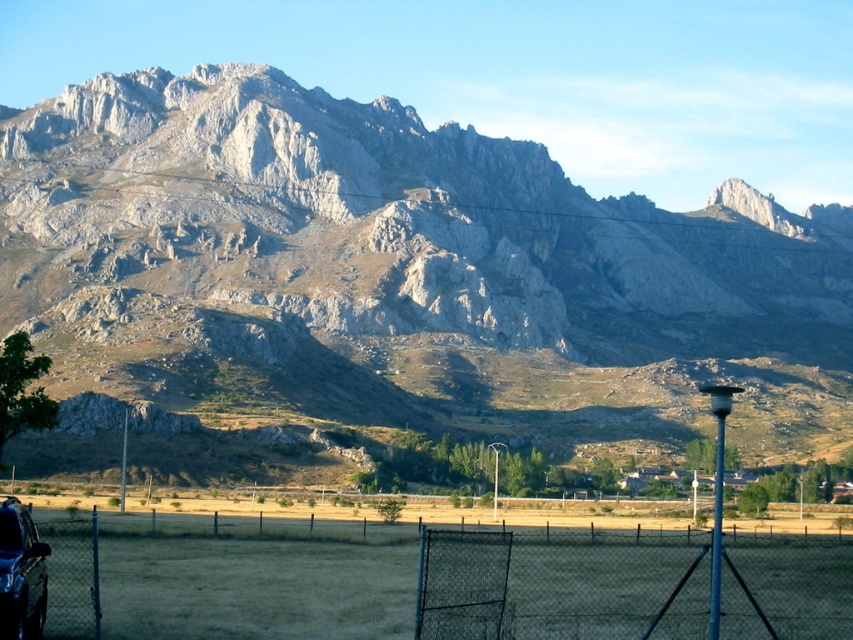
Question: Which of these objects is positioned farthest from the gray chain-link fence at lower center?

Choices:
 (A) gray rock mountain range at upper center
 (B) black chain-link fence at lower center

Answer: (A)

Question: Which object is closer to the camera taking this photo?

Choices:
 (A) gray rock mountain range at upper center
 (B) black chain-link fence at lower center
 (C) gray chain-link fence at lower center

Answer: (B)

Question: Is gray rock mountain range at upper center smaller than shiny black car at lower left?

Choices:
 (A) no
 (B) yes

Answer: (A)

Question: Is gray rock mountain range at upper center positioned in front of gray chain-link fence at lower center?

Choices:
 (A) yes
 (B) no

Answer: (B)

Question: Is gray chain-link fence at lower center to the left of shiny black car at lower left from the viewer's perspective?

Choices:
 (A) no
 (B) yes

Answer: (A)

Question: Considering the real-world distances, which object is closest to the gray rock mountain range at upper center?

Choices:
 (A) shiny black car at lower left
 (B) gray chain-link fence at lower center
 (C) black chain-link fence at lower center

Answer: (B)